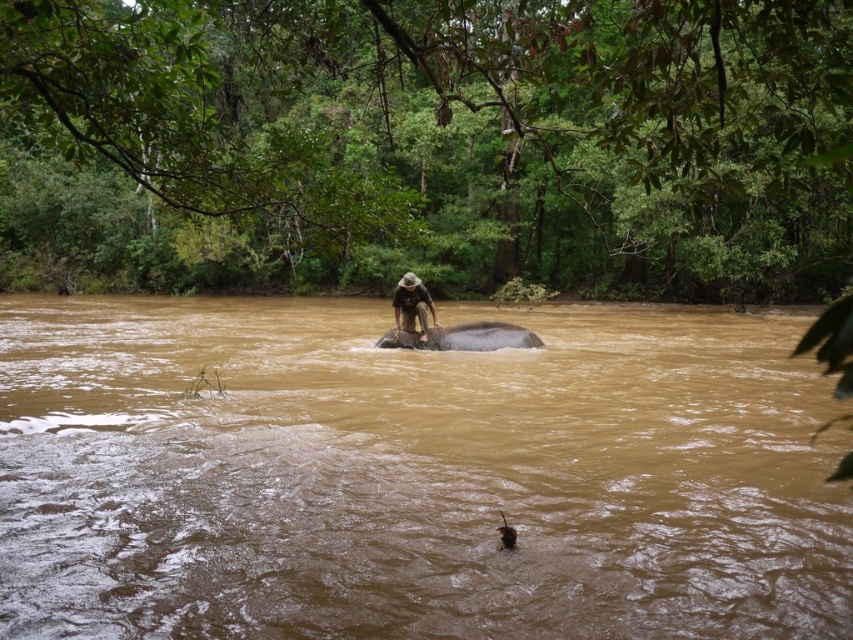
Question: Is gray matte elephant at center to the right of brown textured baby elephant at lower center from the viewer's perspective?

Choices:
 (A) yes
 (B) no

Answer: (B)

Question: Which of the following is the farthest from the observer?

Choices:
 (A) (469, 328)
 (B) (387, 408)

Answer: (A)

Question: Which of the following is the farthest from the observer?

Choices:
 (A) (695, 340)
 (B) (511, 529)

Answer: (A)

Question: Which point is closer to the camera taking this photo?

Choices:
 (A) (115, 410)
 (B) (494, 349)

Answer: (A)

Question: Is brown muddy water at center wider than brown textured baby elephant at lower center?

Choices:
 (A) no
 (B) yes

Answer: (B)

Question: In this image, where is gray matte elephant at center located relative to brown textured baby elephant at lower center?

Choices:
 (A) below
 (B) above

Answer: (B)